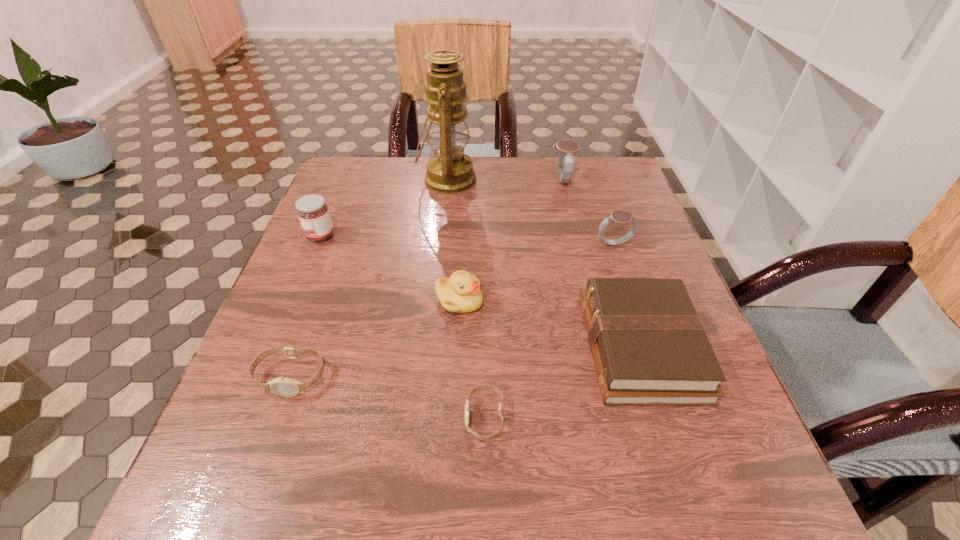
The image size is (960, 540). Find the location of `the tallest object`. the tallest object is located at coordinates (450, 171).

Locate an element on the screen. The width and height of the screenshot is (960, 540). the second watch from right to left is located at coordinates (567, 148).

Locate an element on the screen. Image resolution: width=960 pixels, height=540 pixels. the farther gray watch is located at coordinates (567, 148).

Locate an element on the screen. The image size is (960, 540). jam is located at coordinates (312, 211).

Where is `the second farthest watch`? The height and width of the screenshot is (540, 960). the second farthest watch is located at coordinates (620, 217).

The image size is (960, 540). In order to click on the rightmost watch in this screenshot , I will do `click(620, 217)`.

Locate an element on the screen. The height and width of the screenshot is (540, 960). duckling is located at coordinates (460, 293).

The image size is (960, 540). What are the coordinates of `the sixth tallest object` in the screenshot? It's located at (649, 346).

Locate an element on the screen. the left beige watch is located at coordinates (286, 387).

Find the location of a particular element. Image resolution: width=960 pixels, height=540 pixels. the third tallest watch is located at coordinates pyautogui.click(x=286, y=387).